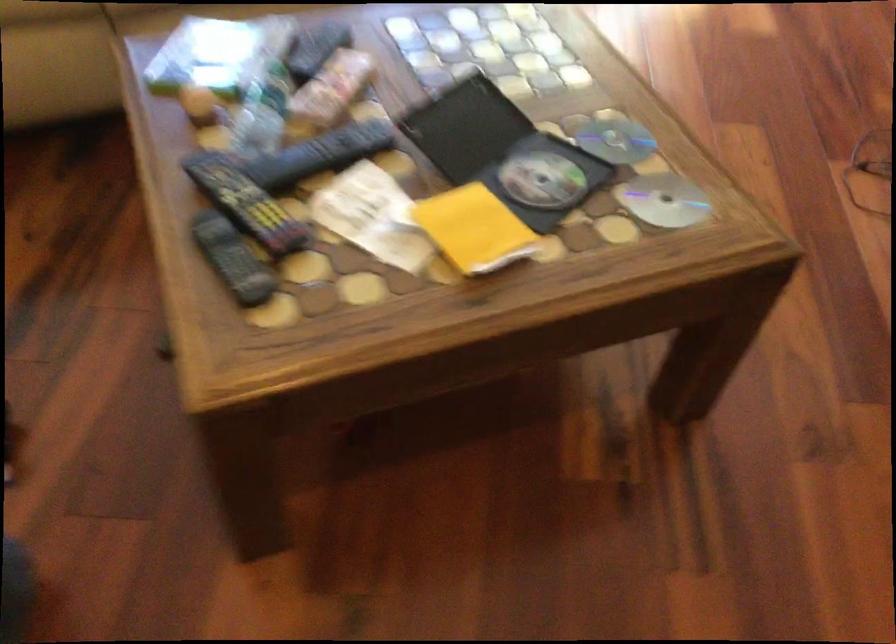
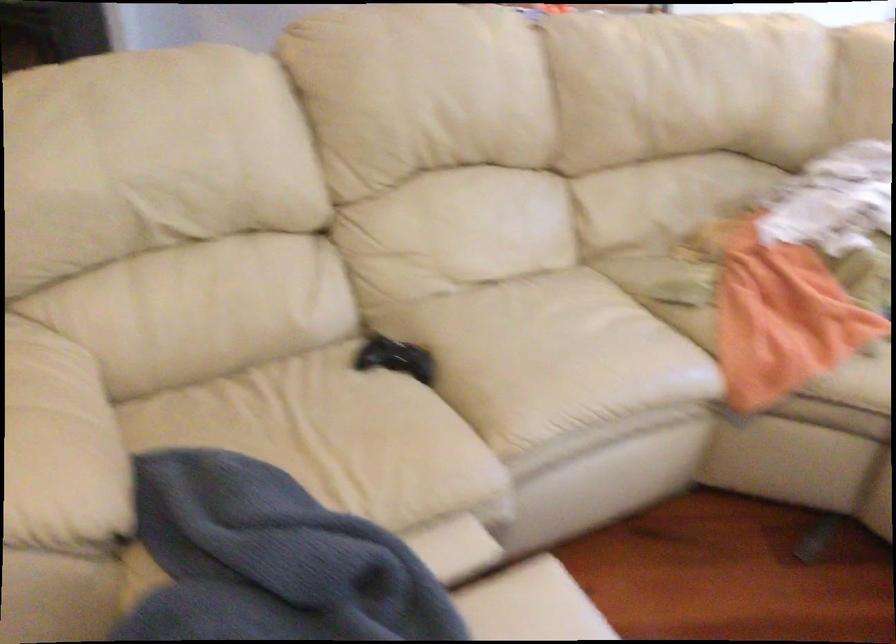
Question: The first image is from the beginning of the video and the second image is from the end. How did the camera likely rotate when shooting the video?

Choices:
 (A) Left
 (B) Right
 (C) Up
 (D) Down

Answer: (A)